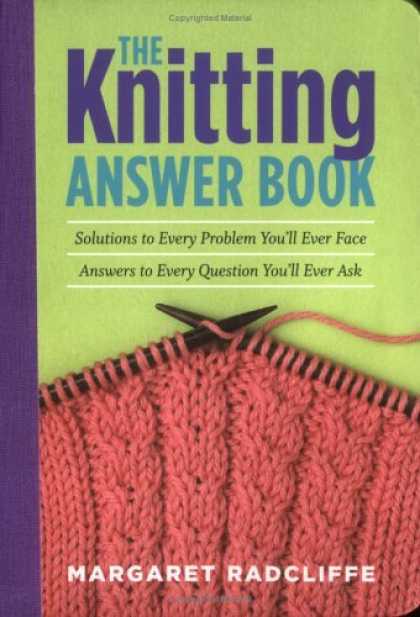
Where is `spine of book`? This screenshot has width=420, height=617. spine of book is located at coordinates (2, 54), (8, 579).